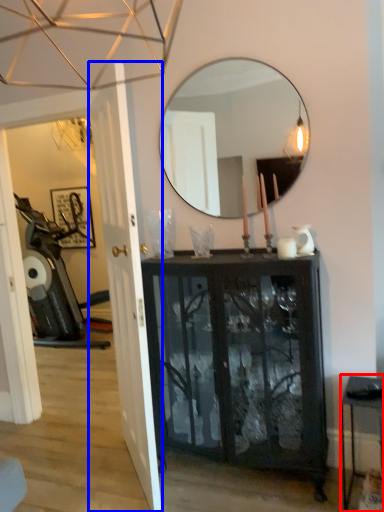
Question: Among these objects, which one is nearest to the camera, table (highlighted by a red box) or door (highlighted by a blue box)?

Choices:
 (A) table
 (B) door

Answer: (B)